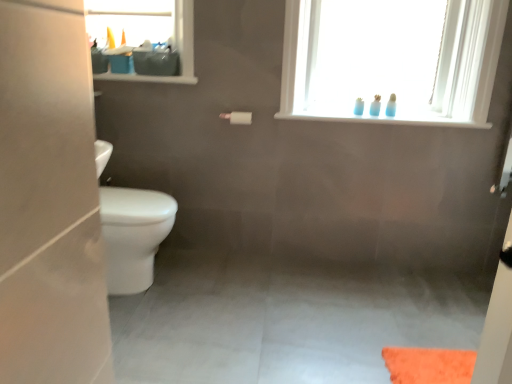
Question: Is white matte toilet paper at center wider or thinner than translucent plastic bottles at upper center, which is the 3th toiletry in right-to-left order?

Choices:
 (A) wide
 (B) thin

Answer: (A)

Question: Considering the positions of point click(x=238, y=114) and point click(x=356, y=107), is point click(x=238, y=114) closer or farther from the camera than point click(x=356, y=107)?

Choices:
 (A) farther
 (B) closer

Answer: (A)

Question: Considering the real-world distances, which object is farthest from the translucent plastic bottles at upper center, arranged as the first toiletry when viewed from the left?

Choices:
 (A) blue plastic toothbrushes at upper right, the second toiletry from the right
 (B) white matte toilet paper at center
 (C) transparent glass bottles at upper center
 (D) blue translucent toothbrushes at upper right, which is the 3th toiletry in left-to-right order

Answer: (B)

Question: Estimate the real-world distances between objects in this image. Which object is closer to the translucent plastic bottles at upper center, arranged as the first toiletry when viewed from the left?

Choices:
 (A) white matte toilet paper at center
 (B) transparent glass bottles at upper center
 (C) blue plastic toothbrushes at upper right, the 2th toiletry in the left-to-right sequence
 (D) blue translucent toothbrushes at upper right, which is the 3th toiletry in left-to-right order

Answer: (C)